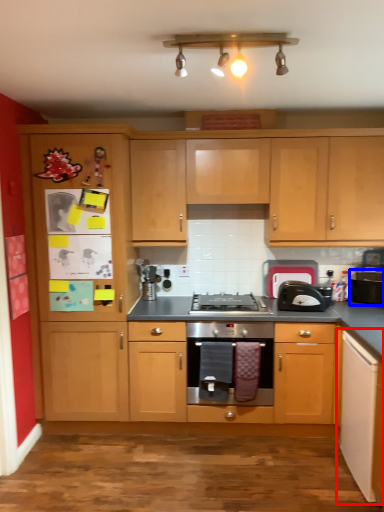
Question: Which object is closer to the camera taking this photo, cabinetry (highlighted by a red box) or appliance (highlighted by a blue box)?

Choices:
 (A) cabinetry
 (B) appliance

Answer: (A)